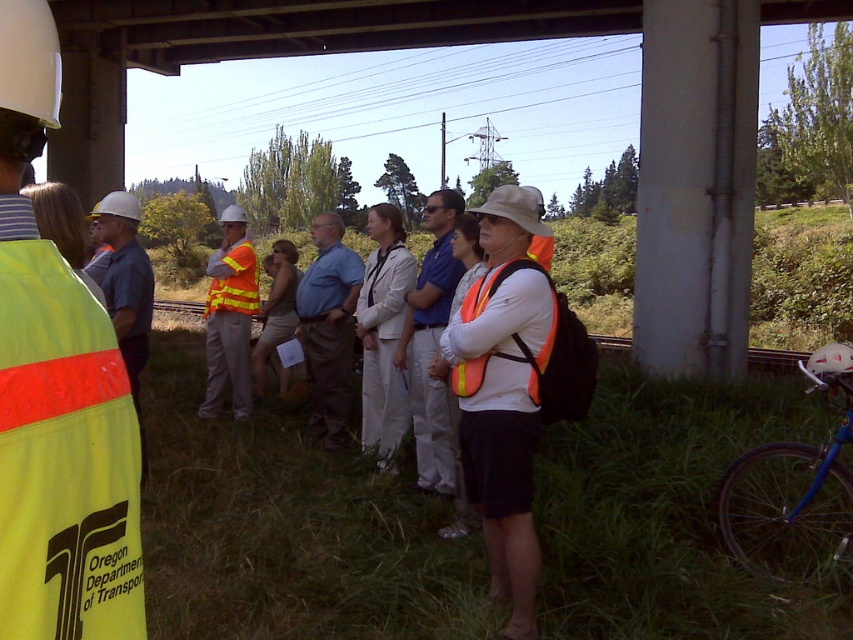
Question: Is brushed metal overpass at upper center bigger than reflective orange vest at center?

Choices:
 (A) yes
 (B) no

Answer: (A)

Question: Which object appears closest to the camera in this image?

Choices:
 (A) orange reflective vest at center
 (B) brushed metal overpass at upper center

Answer: (A)

Question: Is brushed metal overpass at upper center wider than blue fabric shirt at center?

Choices:
 (A) yes
 (B) no

Answer: (A)

Question: Which object is farther from the camera taking this photo?

Choices:
 (A) brushed metal overpass at upper center
 (B) reflective orange vest at center
 (C) matte orange vest at center
 (D) orange reflective vest at center

Answer: (A)

Question: Can you confirm if brushed metal overpass at upper center is smaller than reflective orange safety vest at center?

Choices:
 (A) no
 (B) yes

Answer: (A)

Question: Which object is positioned farthest from the matte orange vest at center?

Choices:
 (A) hi-visibility reflective safety vest at center
 (B) orange reflective vest at center

Answer: (A)